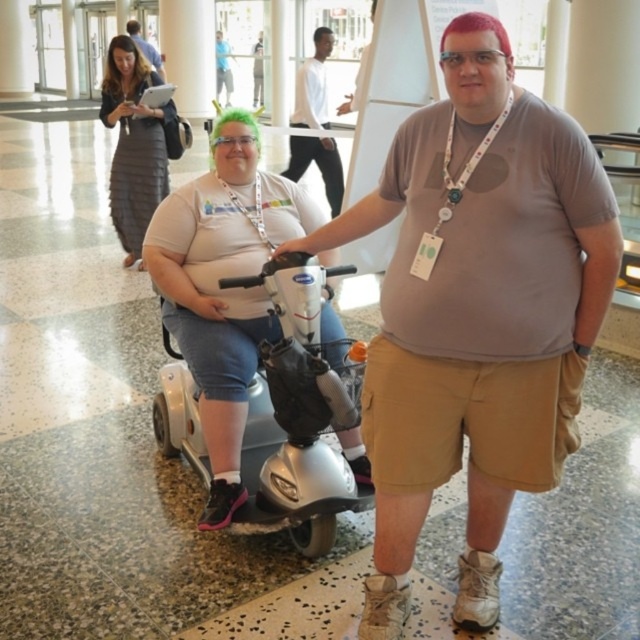
Question: Does white smooth shirt at center have a greater width compared to brown straight hair at upper left?

Choices:
 (A) yes
 (B) no

Answer: (A)

Question: Does silver metallic mobility scooter at center have a smaller size compared to brown straight hair at upper left?

Choices:
 (A) no
 (B) yes

Answer: (A)

Question: Which object is positioned closest to the matte gray shirt at center?

Choices:
 (A) brown straight hair at upper left
 (B) matte black laptop at upper left
 (C) dark gray pleated skirt at upper left

Answer: (C)

Question: Which point is closer to the camera taking this photo?

Choices:
 (A) (326, 177)
 (B) (128, 52)
 (C) (292, 296)
 (D) (509, 360)

Answer: (D)

Question: Can you confirm if matte gray shirt at center is wider than dark gray pleated skirt at upper left?

Choices:
 (A) no
 (B) yes

Answer: (B)

Question: Which of the following is the farthest from the observer?

Choices:
 (A) (307, 104)
 (B) (294, 298)
 (C) (125, 28)
 (D) (444, 374)

Answer: (C)